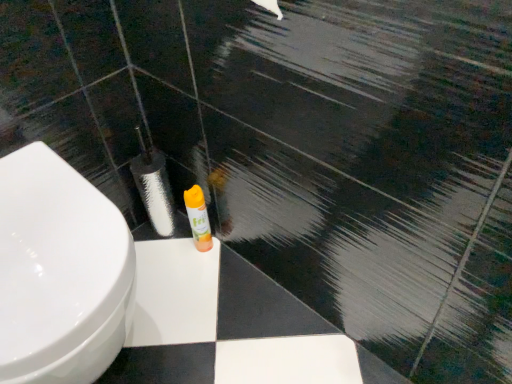
You are a GUI agent. You are given a task and a screenshot of the screen. Output one action in this format:
    pyautogui.click(x=<x>, y=<y>)
    Task: Click on the vacant space situated above white glossy toilet at lower left (from a real-world perspective)
    
    Given the screenshot: What is the action you would take?
    pyautogui.click(x=38, y=218)